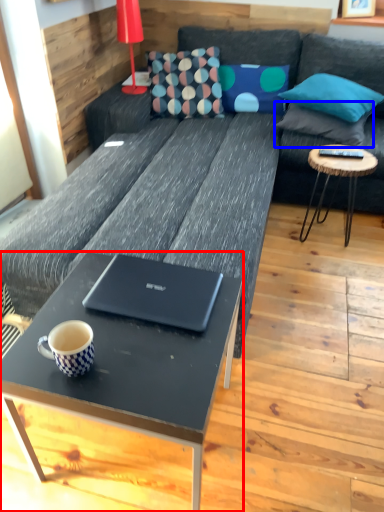
Question: Among these objects, which one is nearest to the camera, coffee table (highlighted by a red box) or pillow (highlighted by a blue box)?

Choices:
 (A) coffee table
 (B) pillow

Answer: (A)